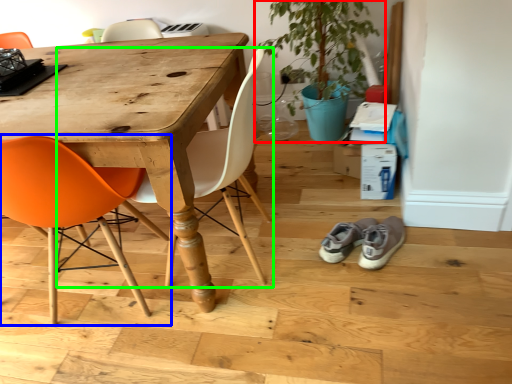
Question: Estimate the real-world distances between objects in this image. Which object is farther from houseplant (highlighted by a red box), chair (highlighted by a blue box) or chair (highlighted by a green box)?

Choices:
 (A) chair
 (B) chair

Answer: (A)